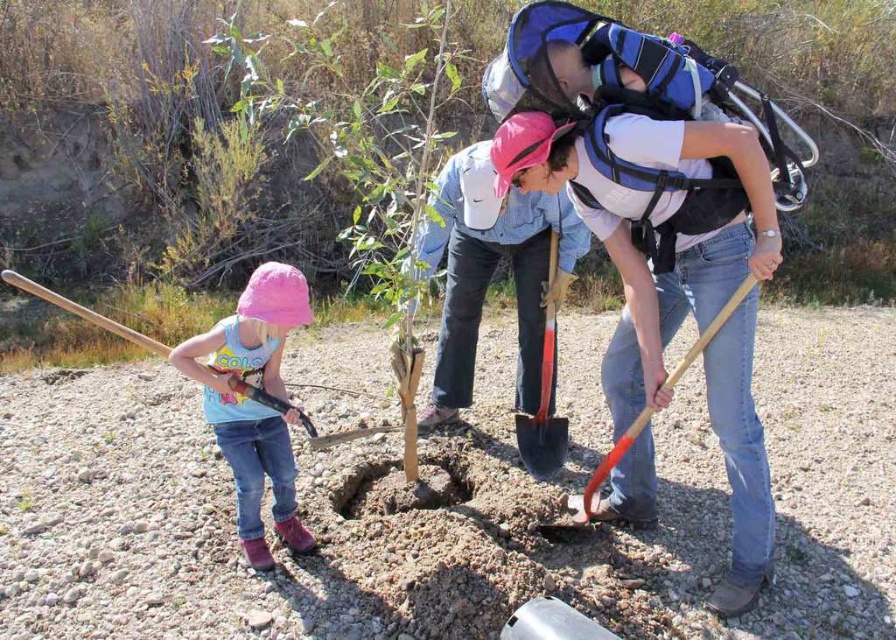
Question: In this image, where is pink fabric hat at left located relative to wooden shovel at left?

Choices:
 (A) right
 (B) left

Answer: (A)

Question: Does pink fabric hat at left have a smaller size compared to red plastic shovel at center?

Choices:
 (A) yes
 (B) no

Answer: (B)

Question: Which object appears farthest from the camera in this image?

Choices:
 (A) red plastic shovel at center
 (B) pink fabric hat at left

Answer: (A)

Question: Based on their relative distances, which object is farther from the red plastic shovel at center?

Choices:
 (A) orange plastic shovel at center
 (B) wooden shovel at left
 (C) pink fabric hat at left
 (D) brown dirt hole at center

Answer: (B)

Question: Which object is farther from the camera taking this photo?

Choices:
 (A) orange plastic shovel at center
 (B) wooden shovel at left

Answer: (B)

Question: Is red plastic shovel at center wider than wooden shovel at left?

Choices:
 (A) no
 (B) yes

Answer: (A)